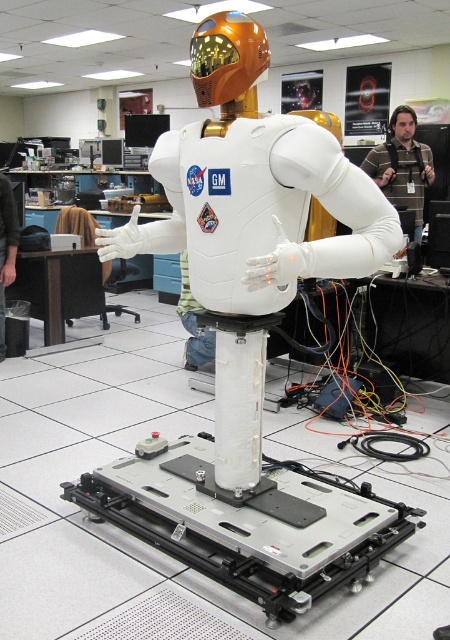
Question: Can you confirm if metallic silver platform at center is wider than dark gray fabric shirt at lower left?

Choices:
 (A) no
 (B) yes

Answer: (B)

Question: Can you confirm if brown striped shirt at center is wider than dark gray fabric shirt at lower left?

Choices:
 (A) yes
 (B) no

Answer: (A)

Question: Which object is closer to the camera taking this photo?

Choices:
 (A) brown striped shirt at center
 (B) dark gray fabric shirt at lower left

Answer: (B)

Question: Which object appears closest to the camera in this image?

Choices:
 (A) metallic silver platform at center
 (B) dark gray fabric shirt at lower left
 (C) brown striped shirt at center

Answer: (A)

Question: Is brown striped shirt at center closer to the viewer compared to dark gray fabric shirt at lower left?

Choices:
 (A) no
 (B) yes

Answer: (A)

Question: Estimate the real-world distances between objects in this image. Which object is closer to the brown striped shirt at center?

Choices:
 (A) dark gray fabric shirt at lower left
 (B) metallic silver platform at center

Answer: (A)